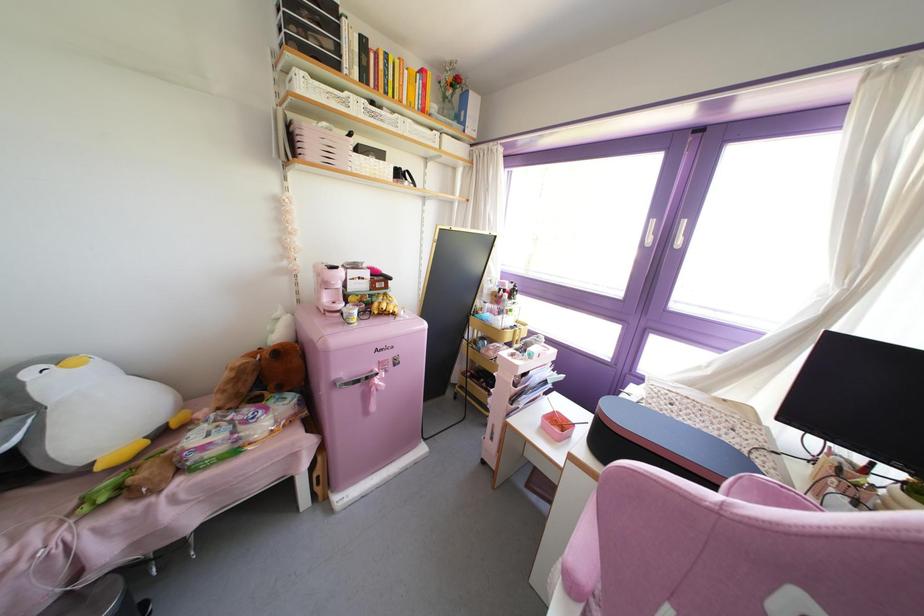
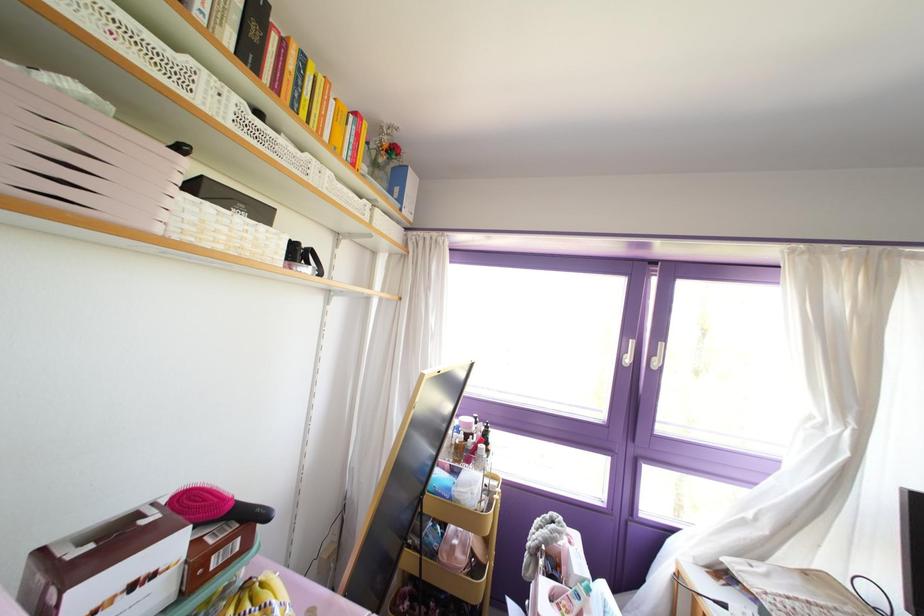
Locate, in the second image, the point that corresponds to [410,99] in the first image.

(335, 143)